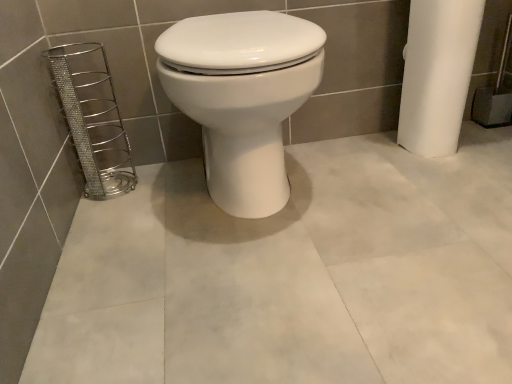
Question: From a real-world perspective, is silver metallic wire basket at left physically located above or below white glossy toilet at center?

Choices:
 (A) above
 (B) below

Answer: (B)

Question: In terms of height, does silver metallic wire basket at left look taller or shorter compared to white glossy toilet at center?

Choices:
 (A) short
 (B) tall

Answer: (A)

Question: Choose the correct answer: Is silver metallic wire basket at left inside white glossy toilet at center or outside it?

Choices:
 (A) inside
 (B) outside

Answer: (B)

Question: Is white glossy toilet at center wider or thinner than silver metallic wire basket at left?

Choices:
 (A) thin
 (B) wide

Answer: (B)

Question: Considering their positions, is white glossy toilet at center located in front of or behind silver metallic wire basket at left?

Choices:
 (A) front
 (B) behind

Answer: (A)

Question: Is white glossy toilet at center situated inside silver metallic wire basket at left or outside?

Choices:
 (A) inside
 (B) outside

Answer: (B)

Question: In terms of height, does white glossy toilet at center look taller or shorter compared to silver metallic wire basket at left?

Choices:
 (A) tall
 (B) short

Answer: (A)